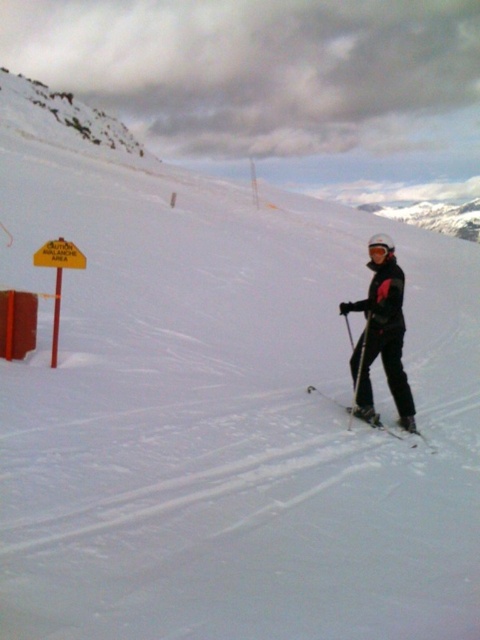
Measure the distance between black plastic ski pole at right and camera.

A distance of 8.28 meters exists between black plastic ski pole at right and camera.

Is black plastic ski pole at right positioned at the back of white matte goggles at center?

That is True.

What do you see at coordinates (359, 372) in the screenshot? This screenshot has width=480, height=640. I see `black plastic ski pole at right` at bounding box center [359, 372].

Where is `black plastic ski pole at right`? The image size is (480, 640). black plastic ski pole at right is located at coordinates pos(359,372).

Based on the photo, does matte black ski at center have a lesser width compared to black plastic ski pole at right?

No.

Is point (352, 412) positioned after point (367, 332)?

Yes, it is.

Is point (411, 444) farther from viewer compared to point (360, 381)?

No, (411, 444) is closer to viewer.

Where is `matte black ski at center`? This screenshot has width=480, height=640. matte black ski at center is located at coordinates (336, 403).

Between point (396, 376) and point (391, 248), which one is positioned in front?

Point (391, 248) is more forward.

Does black matte ski suit at center appear under white matte goggles at center?

Yes, black matte ski suit at center is below white matte goggles at center.

At what (x,y) coordinates should I click in order to perform the action: click on black matte ski suit at center. Please return your answer as a coordinate pair (x, y). This screenshot has width=480, height=640. Looking at the image, I should click on (382, 340).